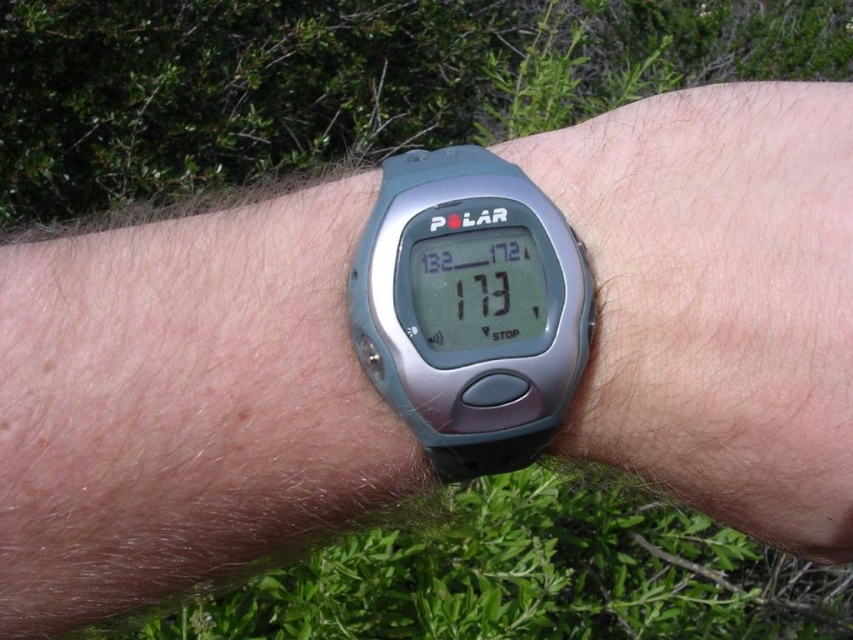
You are a fitness trainer analyzing a client wearing a satin silver watch at center. The watch has a rectangular display showing numbers like 132, 172, and 173. Where exactly on the watch is the number 173 displayed?

The number 173 is prominently displayed in the center of the satin silver watch at center, as mentioned in the scene description.

Looking at this image, you are a fitness trainer assessing a client wearing two watches. The client has a satin silver watch at center and a silver metallic watch at center. Which watch is bigger?

The satin silver watch at center has a larger size compared to the silver metallic watch at center.

Looking at this image, you are a fitness trainer observing a client wearing a Polar watch. The watch displays a point at coordinates [543,163]. If the point is 14.95 inches away from your eyes, can you reach it to adjust the watch without moving your hand?

The point at coordinates [543,163] is 14.95 inches away from the viewer. Since this distance is within typical arm reach, you can adjust the watch without moving your hand.